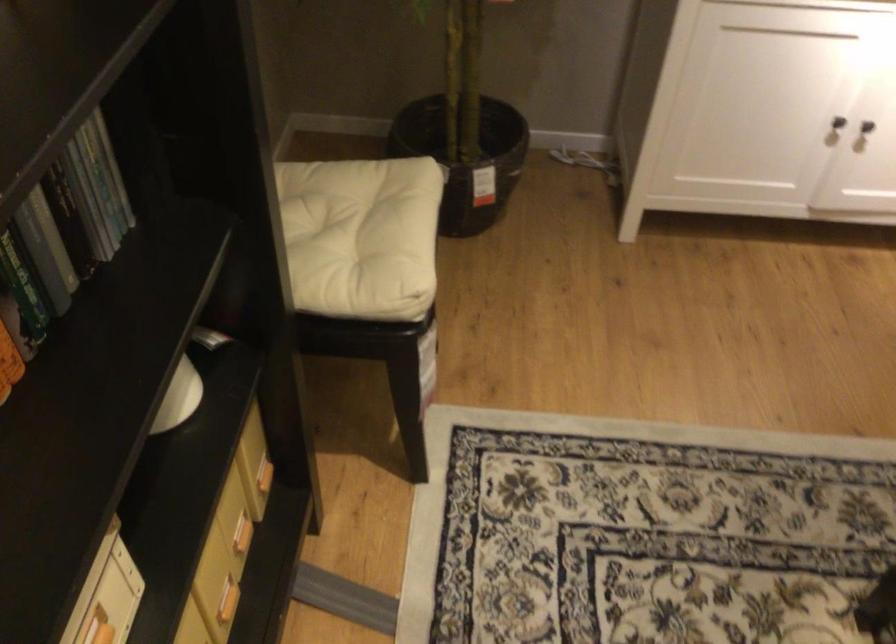
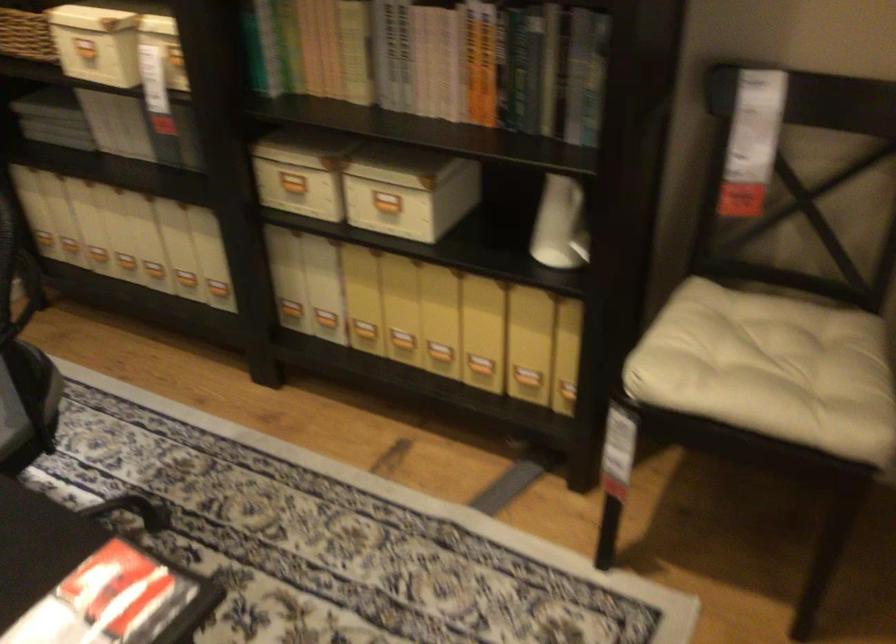
Find the pixel in the second image that matches (177,371) in the first image.

(582, 238)